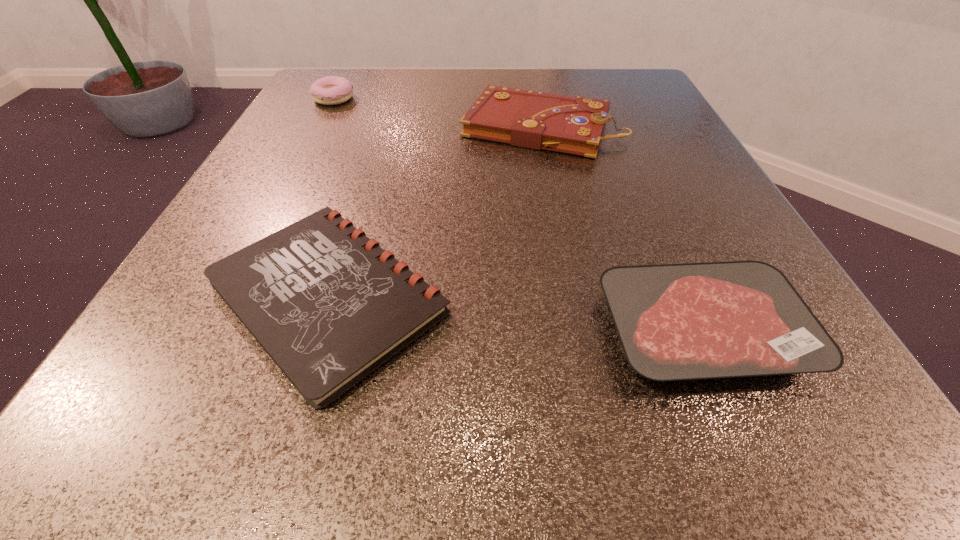
Locate an element on the screen. The image size is (960, 540). free space that satisfies the following two spatial constraints: 1. on the front side of the steak; 2. on the left side of the nearer notebook is located at coordinates (318, 330).

Where is `free space in the image that satisfies the following two spatial constraints: 1. on the front side of the steak; 2. on the left side of the nearer notebook`? free space in the image that satisfies the following two spatial constraints: 1. on the front side of the steak; 2. on the left side of the nearer notebook is located at coordinates (318, 330).

At what (x,y) coordinates should I click in order to perform the action: click on vacant point that satisfies the following two spatial constraints: 1. on the front side of the steak; 2. on the left side of the nearer notebook. Please return your answer as a coordinate pair (x, y). Looking at the image, I should click on (318, 330).

The height and width of the screenshot is (540, 960). Find the location of `vacant area that satisfies the following two spatial constraints: 1. on the back side of the nearer notebook; 2. on the left side of the farther notebook`. vacant area that satisfies the following two spatial constraints: 1. on the back side of the nearer notebook; 2. on the left side of the farther notebook is located at coordinates click(382, 126).